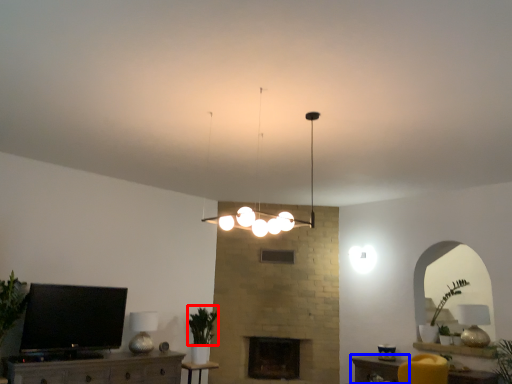
Question: Which object is closer to the camera taking this photo, plant (highlighted by a red box) or table (highlighted by a blue box)?

Choices:
 (A) plant
 (B) table

Answer: (B)